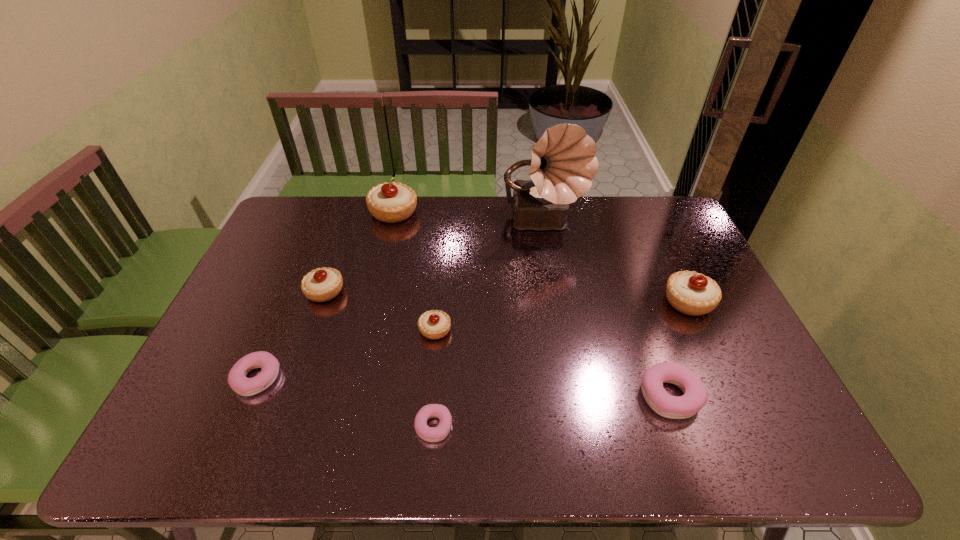
In order to click on the third object from right to left in this screenshot , I will do `click(563, 162)`.

In order to click on the tallest object in this screenshot , I will do `click(563, 162)`.

Image resolution: width=960 pixels, height=540 pixels. Find the location of `the second tallest object`. the second tallest object is located at coordinates (391, 202).

Locate an element on the screen. This screenshot has height=540, width=960. the second beige pastry from left to right is located at coordinates (391, 202).

Find the location of a particular element. Image resolution: width=960 pixels, height=540 pixels. the rightmost pastry is located at coordinates (692, 293).

The height and width of the screenshot is (540, 960). I want to click on the rightmost object, so click(692, 293).

Where is `the third tallest pastry`? Image resolution: width=960 pixels, height=540 pixels. the third tallest pastry is located at coordinates [322, 284].

This screenshot has width=960, height=540. What are the coordinates of `the third biggest beige pastry` in the screenshot? It's located at (322, 284).

Where is `the second beige pastry from right to left`? The image size is (960, 540). the second beige pastry from right to left is located at coordinates (433, 324).

Find the location of a particular element. Image resolution: width=960 pixels, height=540 pixels. the fourth tallest pastry is located at coordinates (433, 324).